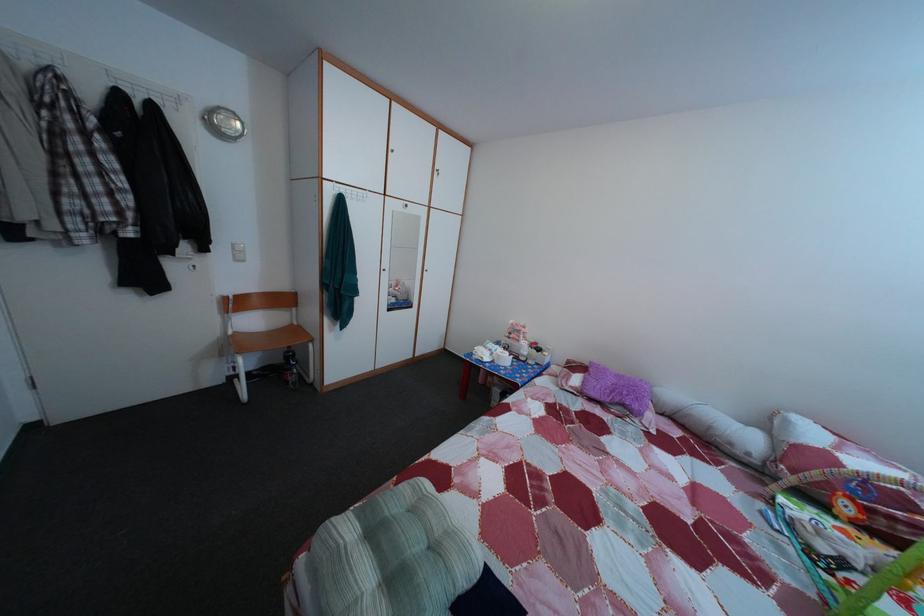
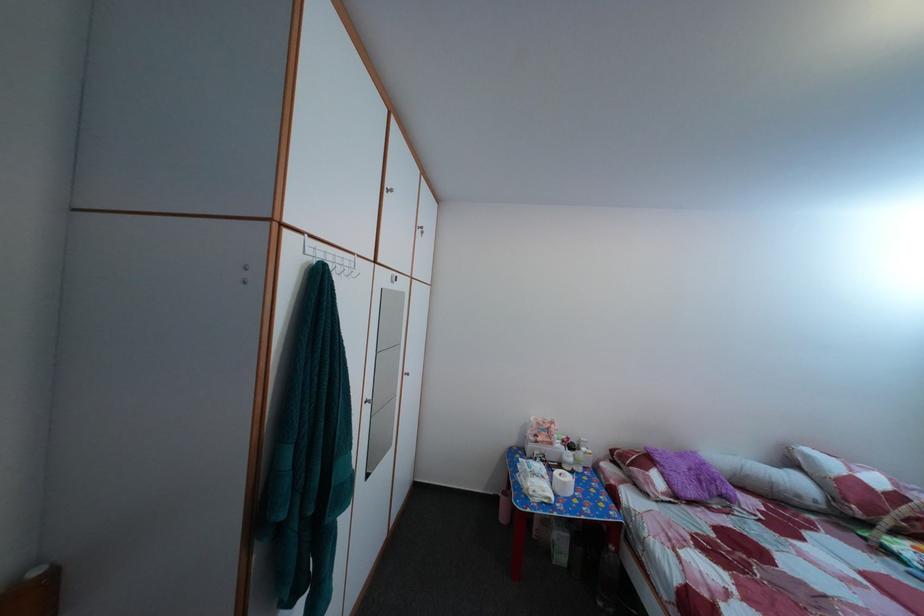
In the second image, find the point that corresponds to pixel 796 430 in the first image.

(817, 464)